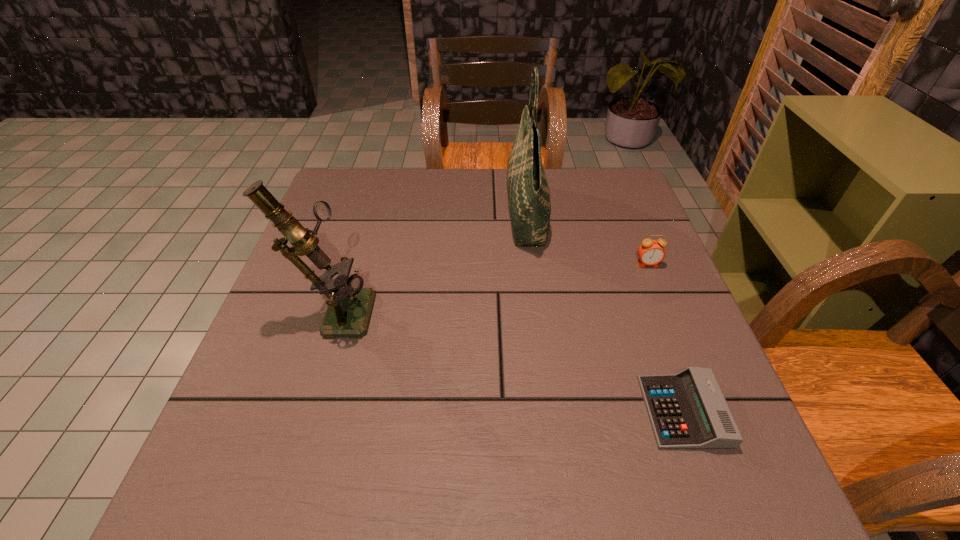
The image size is (960, 540). What are the coordinates of `object that ranks as the second closest to the tallest object` in the screenshot? It's located at (349, 308).

The width and height of the screenshot is (960, 540). I want to click on object that is the third closest to the tote bag, so click(687, 410).

The height and width of the screenshot is (540, 960). Identify the location of vacant space that satisfies the following two spatial constraints: 1. at the eyepiece of the calculator; 2. on the right side of the second nearest object. (303, 411).

Identify the location of vacant space that satisfies the following two spatial constraints: 1. at the eyepiece of the microscope; 2. on the left side of the shortest object. (303, 411).

Where is `vacant space that satisfies the following two spatial constraints: 1. on the back side of the shortest object; 2. at the eyepiece of the microscope`? vacant space that satisfies the following two spatial constraints: 1. on the back side of the shortest object; 2. at the eyepiece of the microscope is located at coordinates (646, 309).

Find the location of a particular element. This screenshot has width=960, height=540. vacant position in the image that satisfies the following two spatial constraints: 1. on the face of the third nearest object; 2. at the eyepiece of the second tallest object is located at coordinates (666, 309).